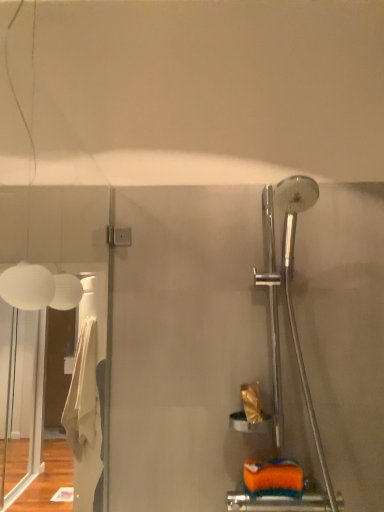
The height and width of the screenshot is (512, 384). What do you see at coordinates (273, 478) in the screenshot?
I see `orange microfiber cloth at lower right` at bounding box center [273, 478].

Find the location of a particular element. This screenshot has width=384, height=512. orange microfiber cloth at lower right is located at coordinates (273, 478).

Where is `orange microfiber cloth at lower right`? The height and width of the screenshot is (512, 384). orange microfiber cloth at lower right is located at coordinates (273, 478).